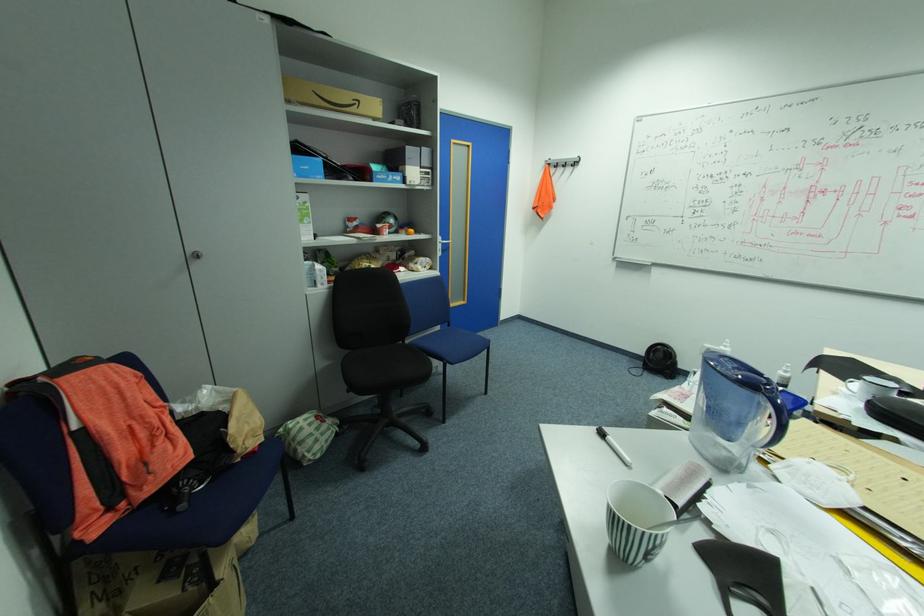
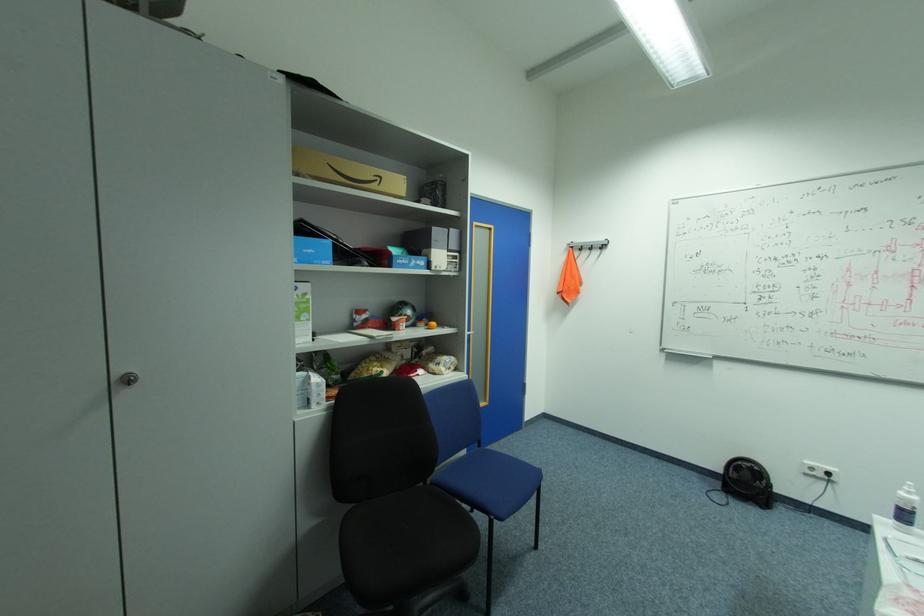
Locate, in the second image, the point that corresponds to point (323, 273) in the first image.

(321, 387)